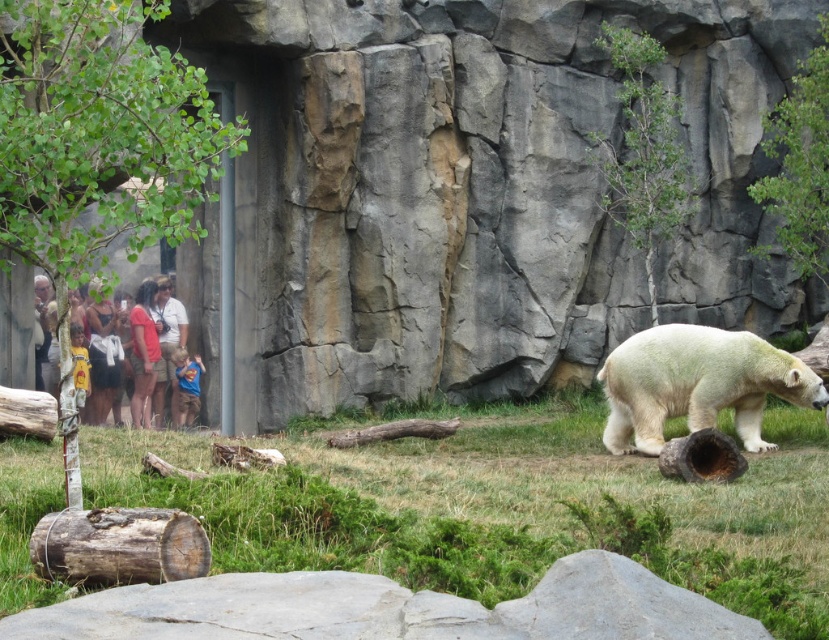
Question: From the image, what is the correct spatial relationship of green leafy tree at upper right in relation to blue cotton shirt at center?

Choices:
 (A) above
 (B) below

Answer: (A)

Question: Where is green leafy tree at upper right located in relation to weathered brown log at lower left in the image?

Choices:
 (A) right
 (B) left

Answer: (A)

Question: Which point appears farthest from the camera in this image?

Choices:
 (A) (621, 573)
 (B) (182, 512)

Answer: (B)

Question: Which object is farther from the camera taking this photo?

Choices:
 (A) blue cotton shirt at center
 (B) brown rough log at lower left
 (C) white fur bear at center
 (D) green leafy tree at upper center

Answer: (A)

Question: Is white fur bear at center to the left of weathered brown log at lower left from the viewer's perspective?

Choices:
 (A) yes
 (B) no

Answer: (B)

Question: Which object is closer to the camera taking this photo?

Choices:
 (A) green leafy tree at upper right
 (B) gray rough rock at lower center
 (C) yellow t-shirt at left
 (D) blue cotton shirt at center

Answer: (B)